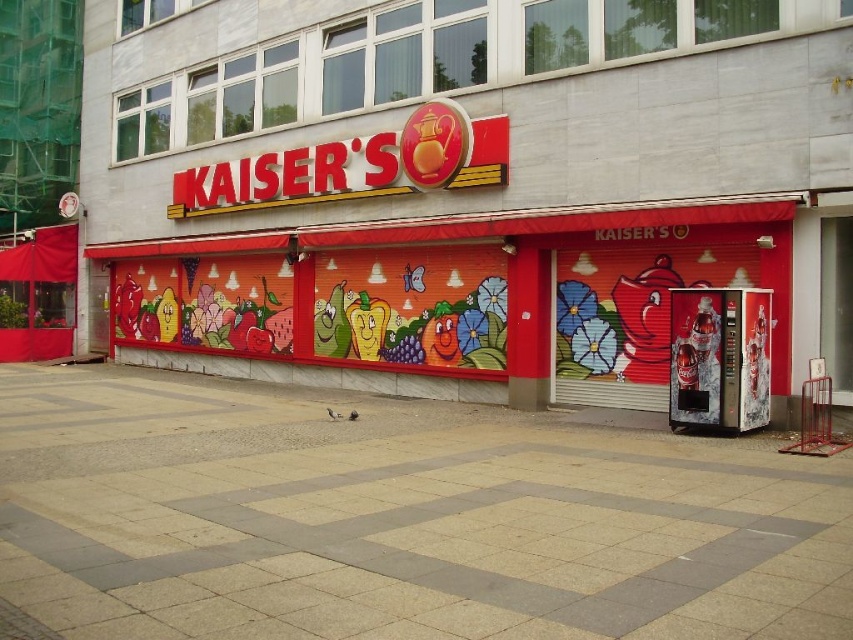
Does matte red vending machine at center right have a lesser height compared to gray concrete pavement at center?

Incorrect, matte red vending machine at center right's height does not fall short of gray concrete pavement at center's.

Does point (630, 56) come farther from viewer compared to point (51, 573)?

Yes, point (630, 56) is farther from viewer.

This screenshot has height=640, width=853. Find the location of `matte red vending machine at center right`. matte red vending machine at center right is located at coordinates (471, 188).